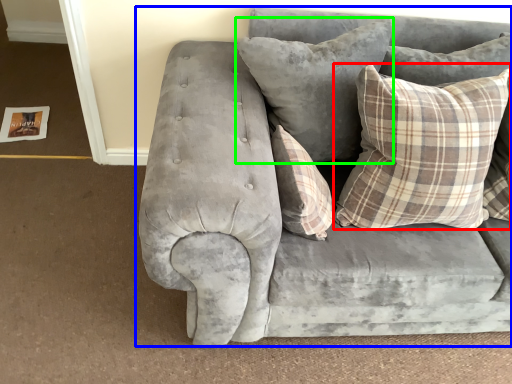
Question: Which is nearer to the pillow (highlighted by a red box)? studio couch (highlighted by a blue box) or pillow (highlighted by a green box).

Choices:
 (A) studio couch
 (B) pillow

Answer: (B)